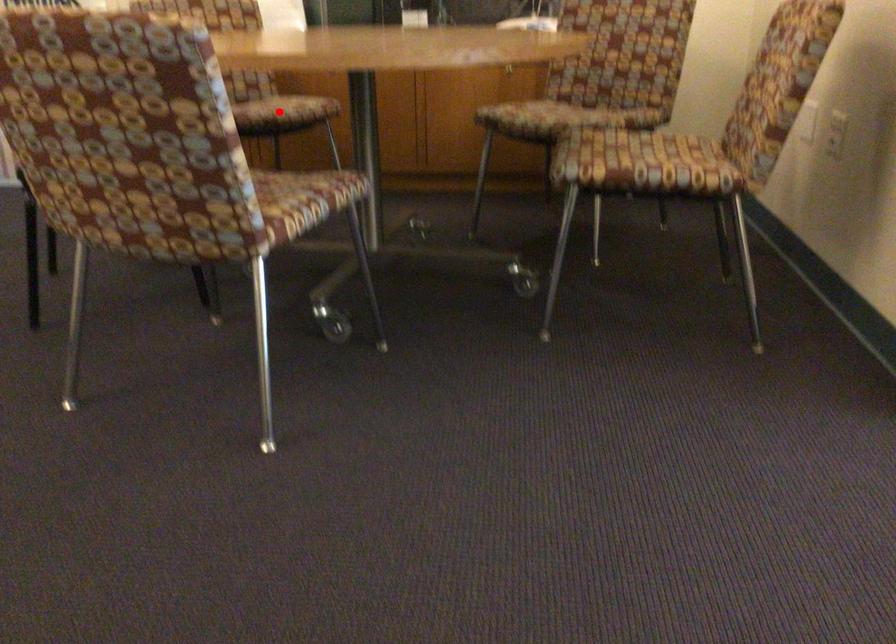
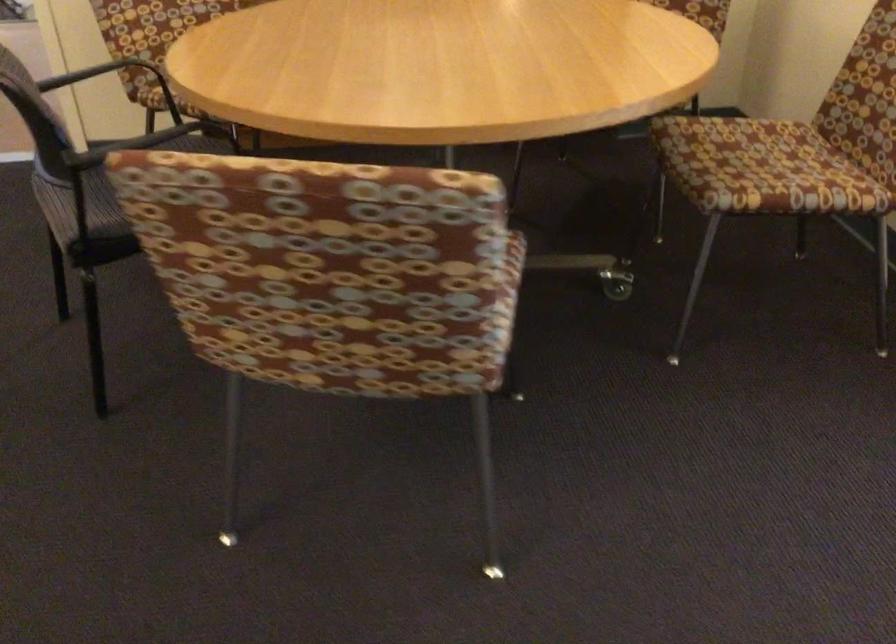
Question: I am providing you with two images of the same scene from different viewpoints. A red point is marked on the first image. At the location where the point appears in image 1, is it still visible in image 2?

Choices:
 (A) Yes
 (B) No

Answer: (B)